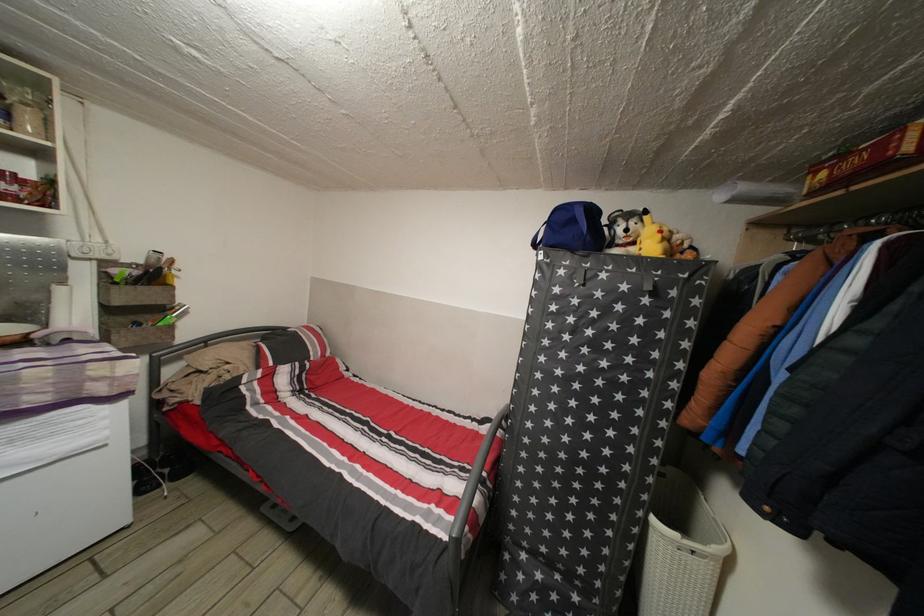
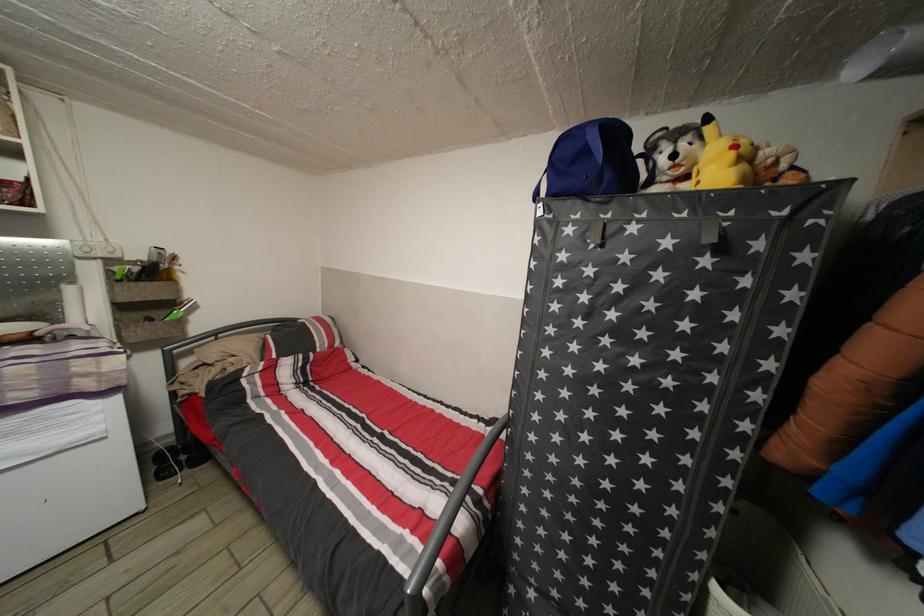
Locate, in the second image, the point that corresponds to (665,243) in the first image.

(738, 161)